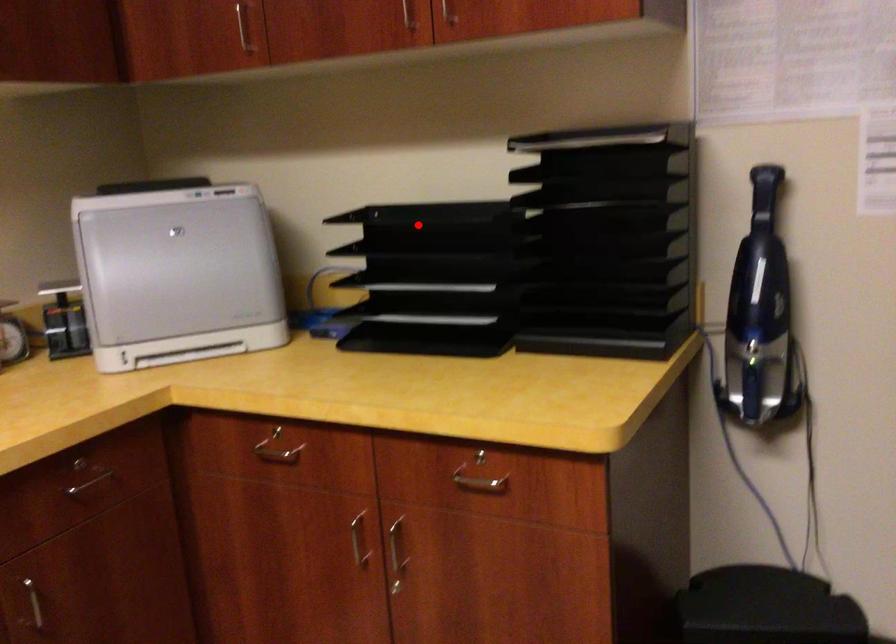
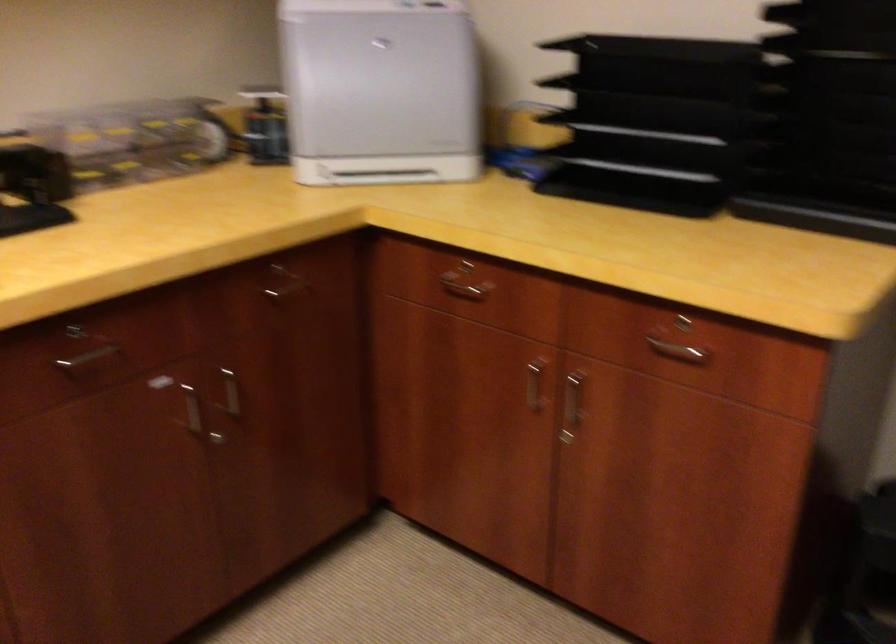
Question: I am providing you with two images of the same scene from different viewpoints. A red point is shown in image1. For the corresponding object point in image2, is it positioned nearer or farther from the camera?

Choices:
 (A) Nearer
 (B) Farther

Answer: (A)